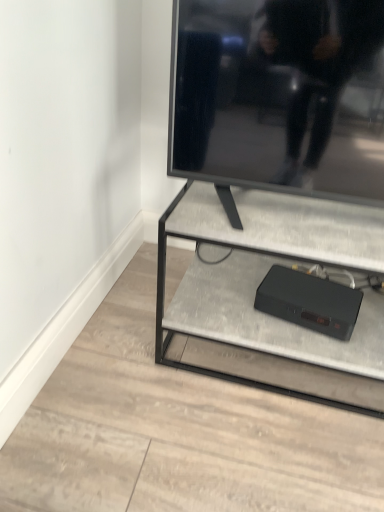
At what (x,y) coordinates should I click in order to perform the action: click on black plastic device at lower center. Please return your answer as a coordinate pair (x, y). Looking at the image, I should click on (309, 301).

Describe the element at coordinates (309, 301) in the screenshot. I see `black plastic device at lower center` at that location.

The width and height of the screenshot is (384, 512). Find the location of `black plastic device at lower center`. black plastic device at lower center is located at coordinates (309, 301).